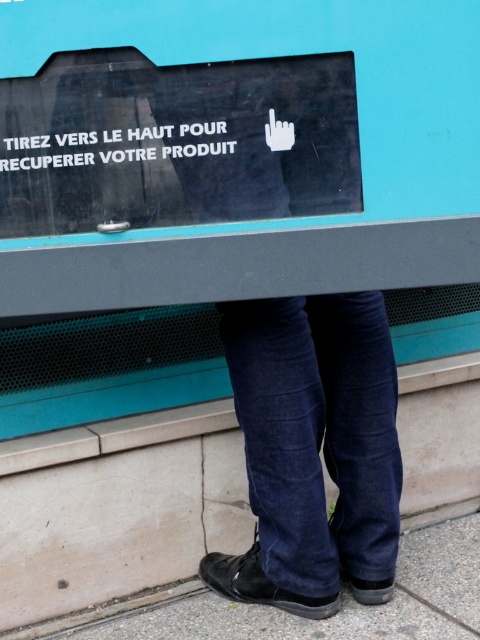
You are a person with a height of 6 feet. You are standing in front of the vending machine and need to reach the black glossy sign at upper center while keeping your denim jeans at lower center on the ground. Can you comfortably reach the sign without bending or stretching too much?

The black glossy sign at upper center is 28.89 inches from the denim jeans at lower center. Since the individual is 6 feet tall, they can comfortably reach the sign without bending or stretching too much as the distance is within a typical comfortable reach range for someone of that height.

You are a delivery robot that needs to place a package at point (54, 60). Your arm can reach up to 4 feet. Can you reach the point?

The distance between the point (54, 60) and the camera is 4.36 feet, which is beyond the robot arm reach of 4 feet. The robot cannot reach the point.